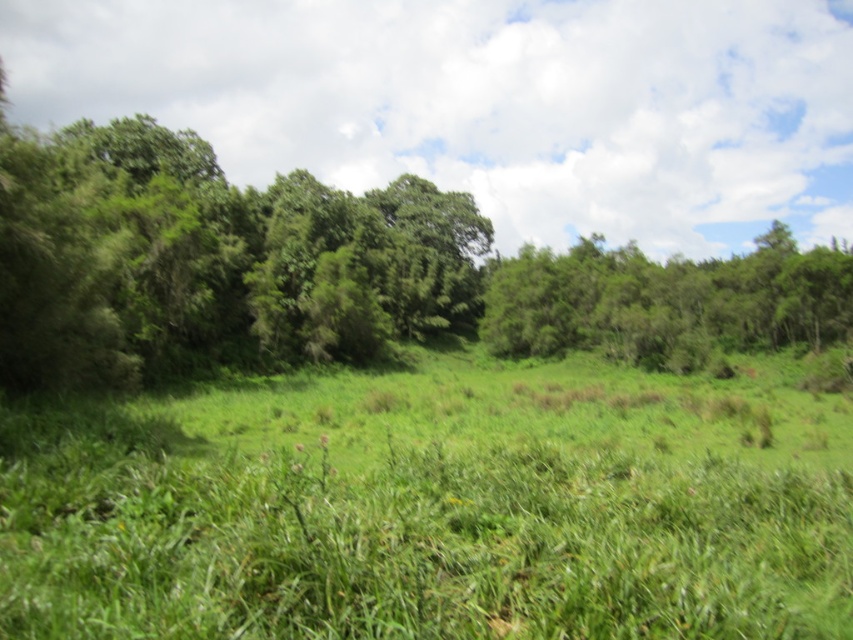
Question: Can you confirm if green grassy field at center is positioned above green leafy forest at center?

Choices:
 (A) yes
 (B) no

Answer: (B)

Question: Is green grassy field at center bigger than green leafy forest at center?

Choices:
 (A) no
 (B) yes

Answer: (A)

Question: Among these objects, which one is nearest to the camera?

Choices:
 (A) green grassy field at center
 (B) green leafy tree at center

Answer: (A)

Question: Which point is closer to the camera taking this photo?

Choices:
 (A) (851, 300)
 (B) (107, 160)

Answer: (B)

Question: Is green grassy field at center to the right of green leafy forest at center from the viewer's perspective?

Choices:
 (A) no
 (B) yes

Answer: (B)

Question: Estimate the real-world distances between objects in this image. Which object is closer to the green leafy tree at center?

Choices:
 (A) green grassy field at center
 (B) green leafy forest at center

Answer: (B)